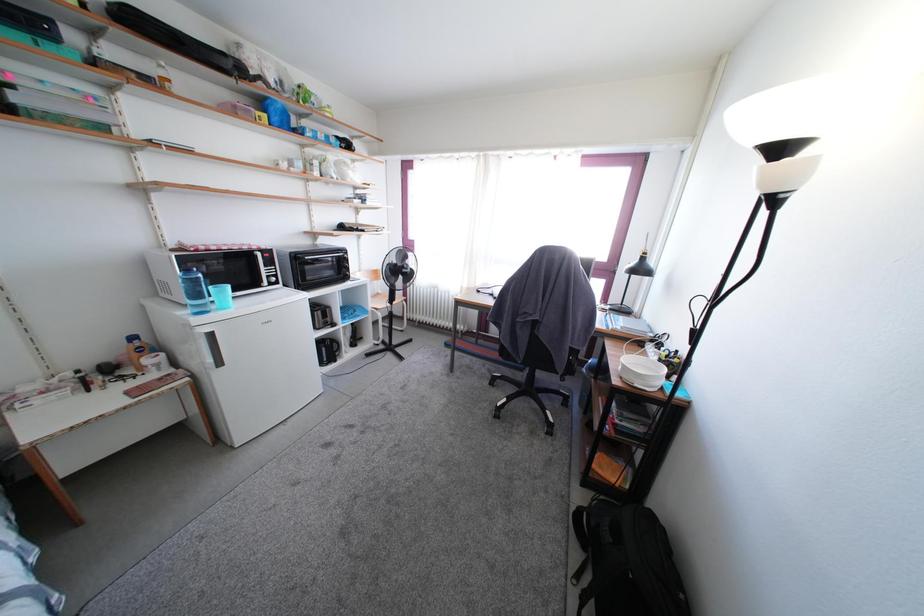
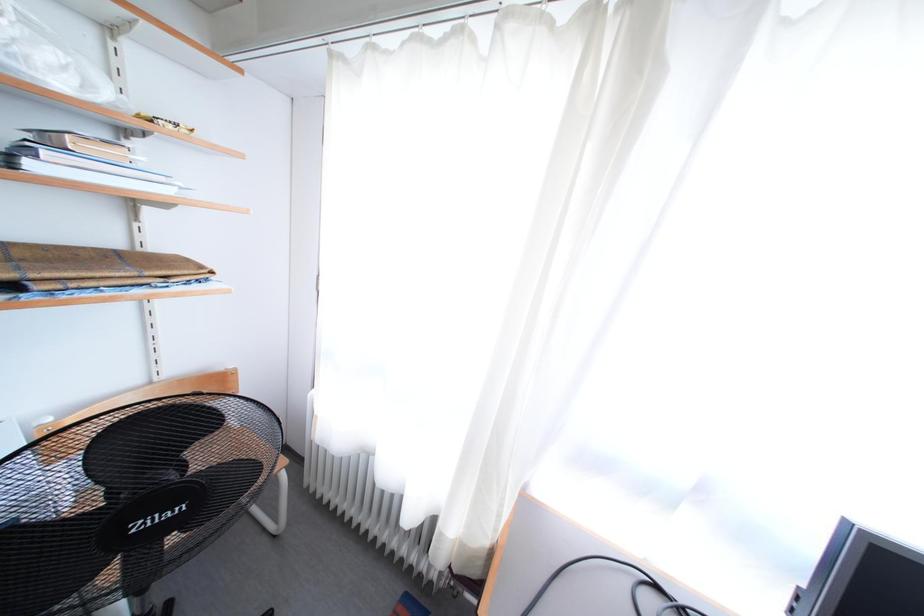
Question: What movement of the cameraman would produce the second image?

Choices:
 (A) Left
 (B) Right
 (C) Forward
 (D) Backward

Answer: (C)